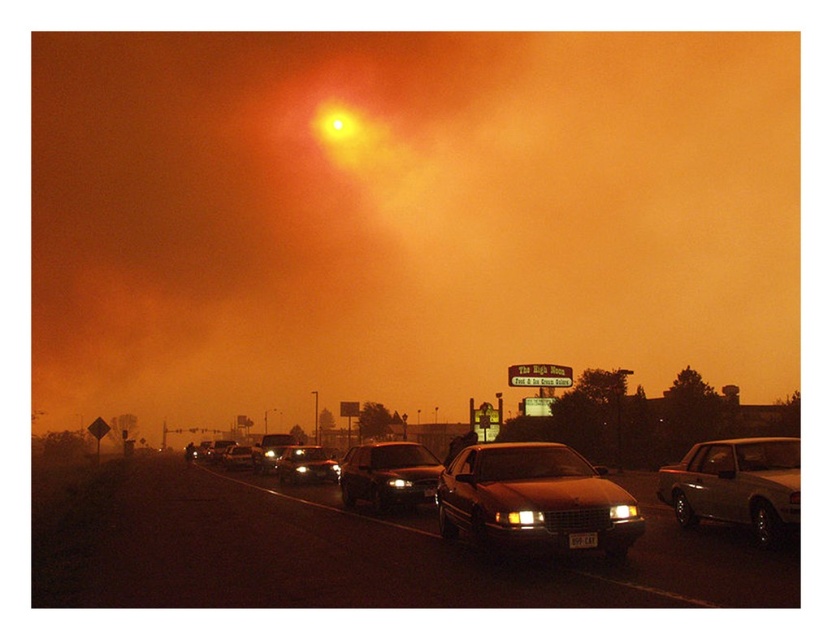
Question: Which of the following is the farthest from the observer?

Choices:
 (A) (240, 444)
 (B) (390, 497)
 (C) (333, 132)

Answer: (C)

Question: Considering the relative positions of matte silver sedan at center and black plastic license plate at lower center in the image provided, where is matte silver sedan at center located with respect to black plastic license plate at lower center?

Choices:
 (A) below
 (B) above

Answer: (A)

Question: Can you confirm if matte glass sun at upper center is bigger than shiny dark brown sedan at center?

Choices:
 (A) no
 (B) yes

Answer: (B)

Question: Can you confirm if shiny dark brown sedan at center is bigger than black plastic license plate at lower center?

Choices:
 (A) no
 (B) yes

Answer: (A)

Question: Estimate the real-world distances between objects in this image. Which object is farther from the matte glass sun at upper center?

Choices:
 (A) matte silver sedan at center
 (B) smokey metallic car at center
 (C) shiny silver sedan at center

Answer: (A)

Question: Which of the following is the farthest from the observer?

Choices:
 (A) (774, 456)
 (B) (342, 490)
 (C) (223, 464)
 (D) (312, 481)

Answer: (C)